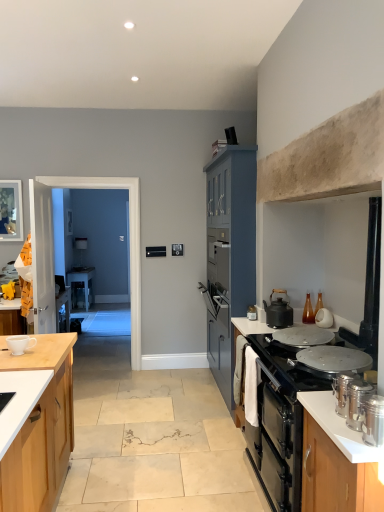
I want to click on vacant space situated on the left part of matte black kettle at right, marked as the second kitchen appliance in a back-to-front arrangement, so click(250, 327).